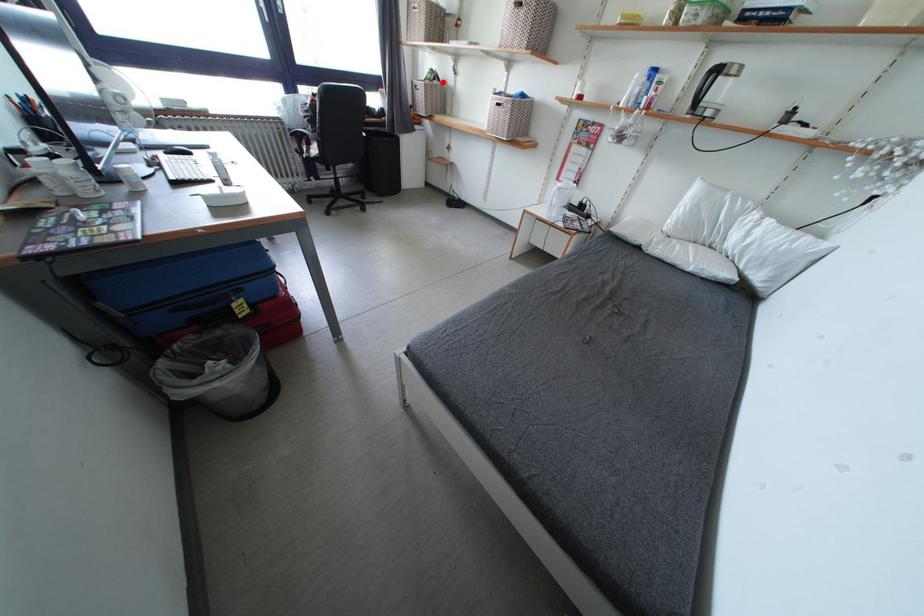
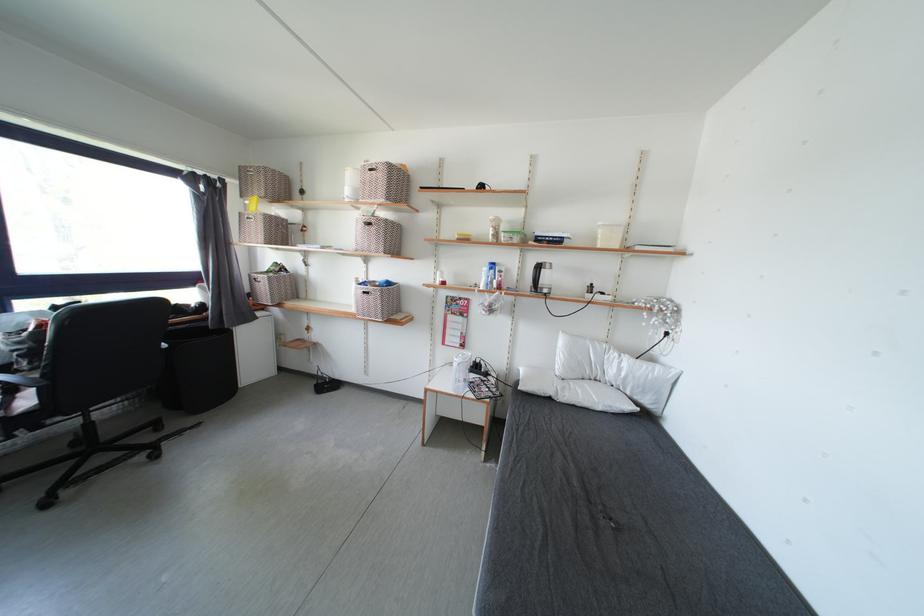
Where in the second image is the point corresponding to the highlighted location from the first image?

(288, 274)